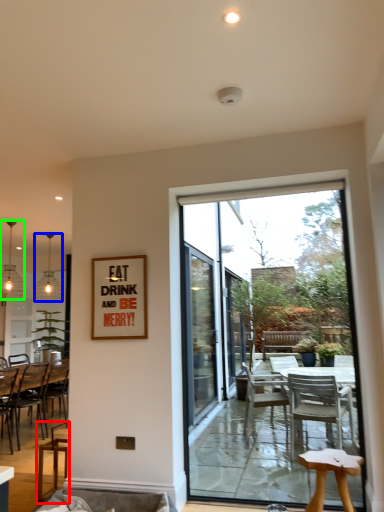
Question: Which is farther away from chair (highlighted by a red box)? lamp (highlighted by a blue box) or lamp (highlighted by a green box)?

Choices:
 (A) lamp
 (B) lamp

Answer: (A)